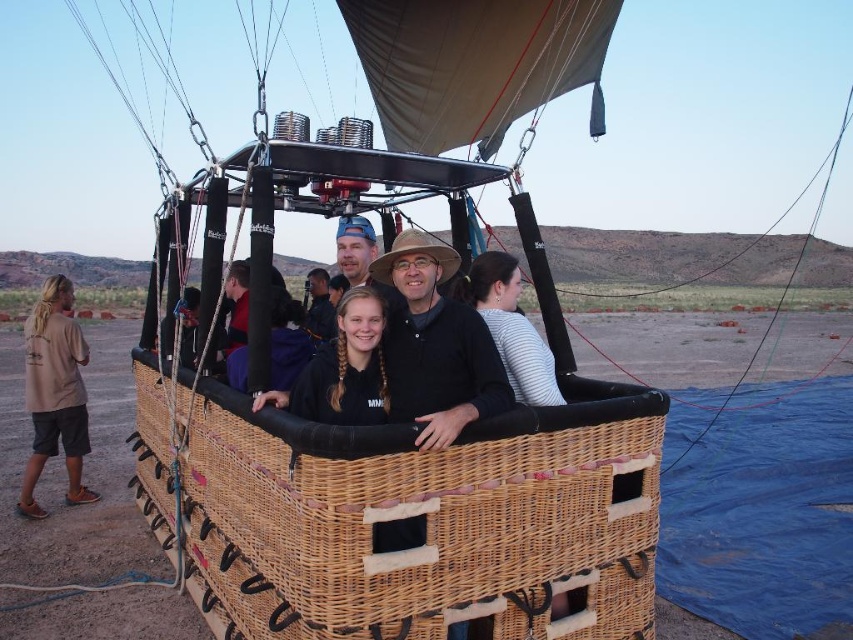
You are standing on the ground looking up at the hot air balloon basket. There is a point at coordinates point [427,518]. Is this point located on the woven wicker basket at center?

Yes, the point [427,518] is on the woven wicker basket at center.

You are a photographer standing near the hot air balloon basket. You want to take a picture of the black fleece jacket at center without including the woven wicker basket at center in the frame. Is this possible given their relative sizes?

The woven wicker basket at center is taller than the black fleece jacket at center, so it is possible to position the camera to capture the black fleece jacket at center while excluding the taller woven wicker basket at center from the frame by adjusting the angle or distance.